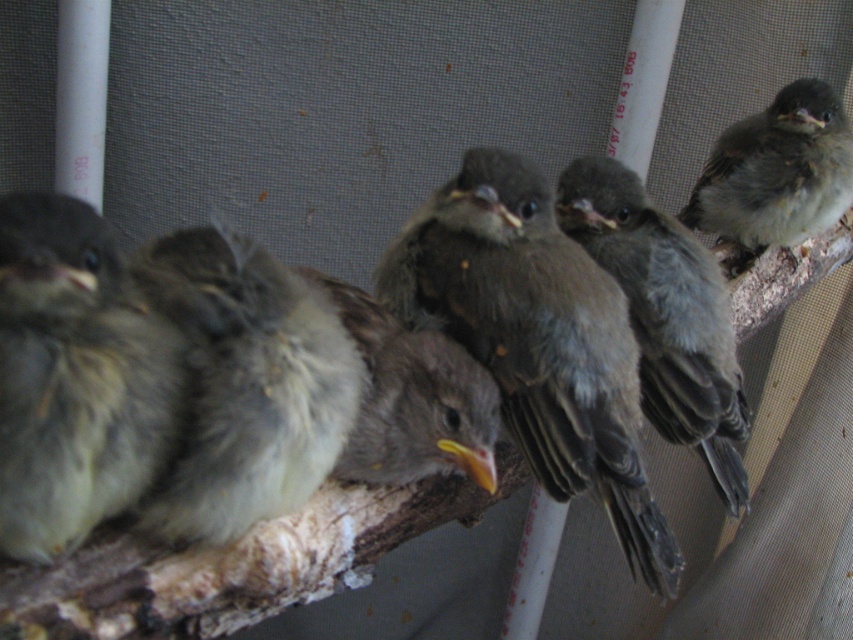
Question: Does brown feathered bird at center have a smaller size compared to brown fluffy bird at center?

Choices:
 (A) no
 (B) yes

Answer: (A)

Question: Which object appears farthest from the camera in this image?

Choices:
 (A) brown fluffy bird at center
 (B) brown feathered bird at center
 (C) gray fluffy bird at center

Answer: (B)

Question: From the image, what is the correct spatial relationship of brown feathered bird at center in relation to gray fluffy bird at center?

Choices:
 (A) left
 (B) right

Answer: (B)

Question: Which of these objects is positioned farthest from the brown fluffy bird at center?

Choices:
 (A) soft gray downy feathers at left
 (B) gray fluffy bird at center
 (C) brown fluffy bird at upper right
 (D) gray downy feathers at center

Answer: (C)

Question: Among these objects, which one is farthest from the camera?

Choices:
 (A) brown fluffy bird at center
 (B) gray fluffy bird at center
 (C) soft gray downy feathers at left
 (D) gray downy feathers at center

Answer: (D)

Question: Does brown feathered bird at center appear over gray fluffy bird at center?

Choices:
 (A) no
 (B) yes

Answer: (B)